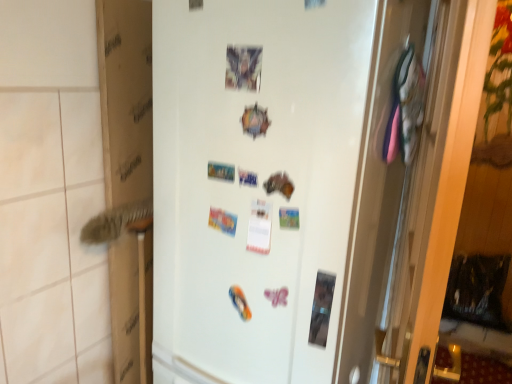
Question: In terms of width, does cardboard at left look wider or thinner when compared to white matte refrigerator at center?

Choices:
 (A) thin
 (B) wide

Answer: (A)

Question: Considering the positions of cardboard at left and white matte refrigerator at center in the image, is cardboard at left taller or shorter than white matte refrigerator at center?

Choices:
 (A) tall
 (B) short

Answer: (B)

Question: Estimate the real-world distances between objects in this image. Which object is farther from the cardboard at left?

Choices:
 (A) white matte refrigerator at center
 (B) matte plastic postcard at upper center

Answer: (B)

Question: Which of these objects is positioned closest to the matte plastic postcard at upper center?

Choices:
 (A) cardboard at left
 (B) white matte refrigerator at center

Answer: (B)